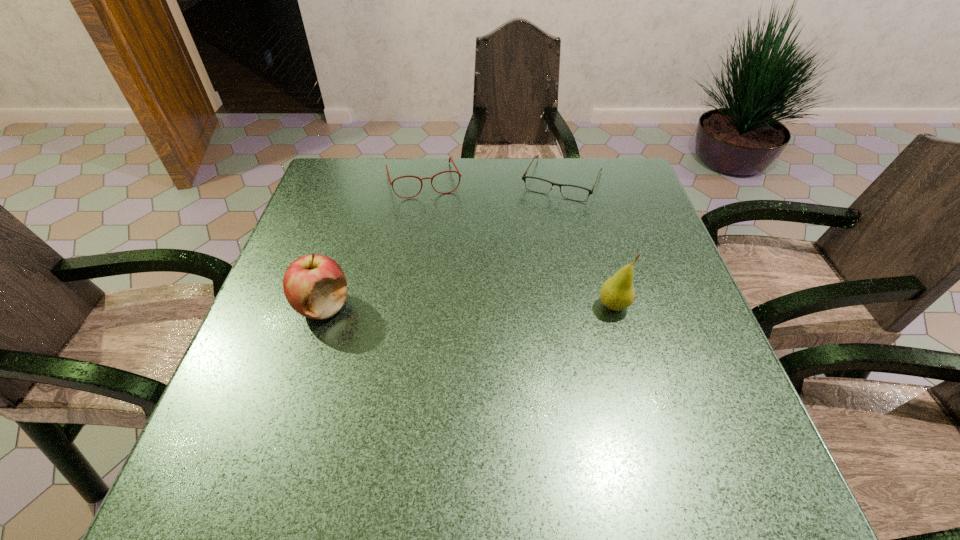
I want to click on free space located on the face of the third tallest object, so click(x=453, y=289).

Identify the location of free space located on the front-facing side of the right spectacles. This screenshot has width=960, height=540. (515, 286).

At what (x,y) coordinates should I click in order to perform the action: click on vacant space situated on the front-facing side of the right spectacles. Please return your answer as a coordinate pair (x, y). The image size is (960, 540). Looking at the image, I should click on (504, 308).

The image size is (960, 540). I want to click on vacant space located on the front-facing side of the right spectacles, so click(x=511, y=295).

You are a GUI agent. You are given a task and a screenshot of the screen. Output one action in this format:
    pyautogui.click(x=<x>, y=<y>)
    Task: Click on the object present at the left edge
    The height and width of the screenshot is (540, 960).
    Given the screenshot: What is the action you would take?
    pyautogui.click(x=315, y=286)

Identify the location of pear located in the right edge section of the desktop. (617, 293).

At what (x,y) coordinates should I click in order to perform the action: click on spectacles that is at the right edge. Please return your answer as a coordinate pair (x, y). Image resolution: width=960 pixels, height=540 pixels. Looking at the image, I should click on (572, 192).

Locate an element on the screen. The height and width of the screenshot is (540, 960). object that is at the far right corner is located at coordinates (572, 192).

Locate an element on the screen. vacant space at the far edge of the desktop is located at coordinates (378, 188).

In the image, there is a desktop. Find the location of `vacant space at the left edge`. vacant space at the left edge is located at coordinates (314, 247).